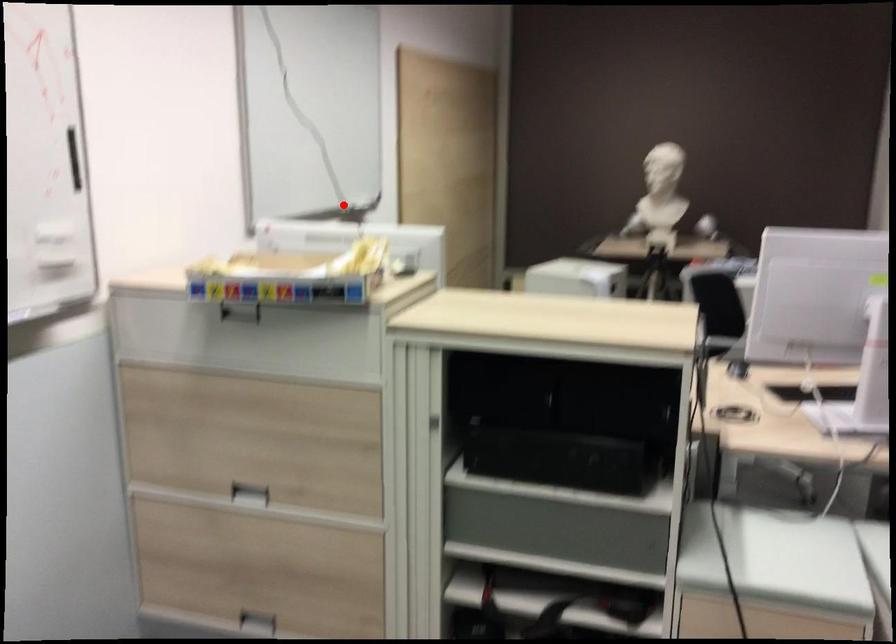
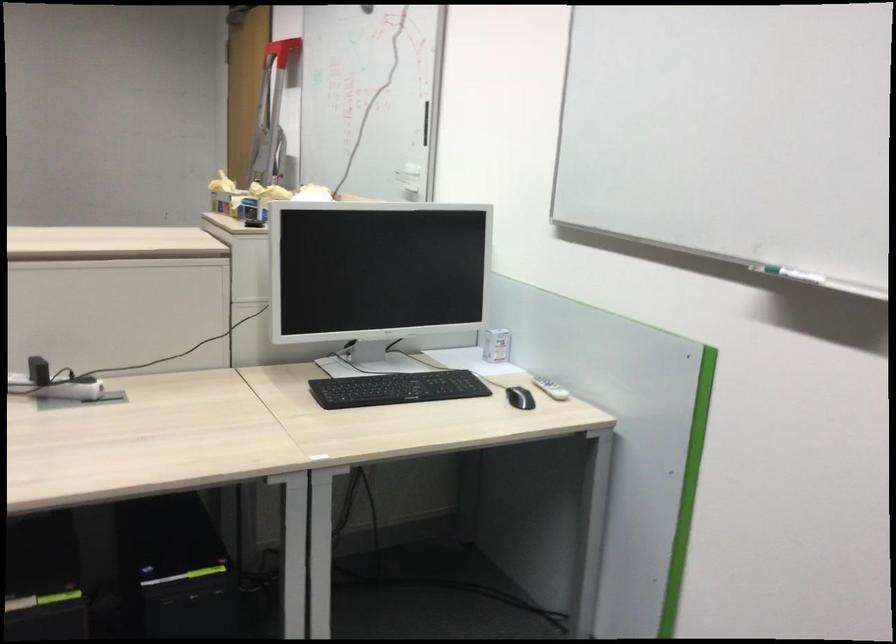
Question: I am providing you with two images of the same scene from different viewpoints. Given a red point in image1, look at the same physical point in image2. Is it:

Choices:
 (A) Closer to the viewpoint
 (B) Farther from the viewpoint

Answer: (A)